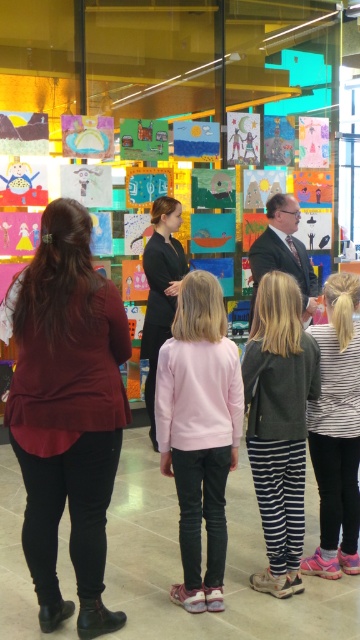
You are a photographer trying to capture a clear shot of the matte burgundy blouse at center and the black matte dress at center. Based on their positions, which one is closer to the camera?

The matte burgundy blouse at center is below the black matte dress at center, so the black matte dress at center is closer to the camera since it is positioned above.

You are standing at the entrance of the room and want to greet both the person wearing the pink matte sweater at center and the person in the dark suit at center. Which one should you approach first if you want to minimize the walking distance?

The pink matte sweater at center and dark suit at center are both at center, so they are equidistant from you. Approach either one first as the distance is the same.